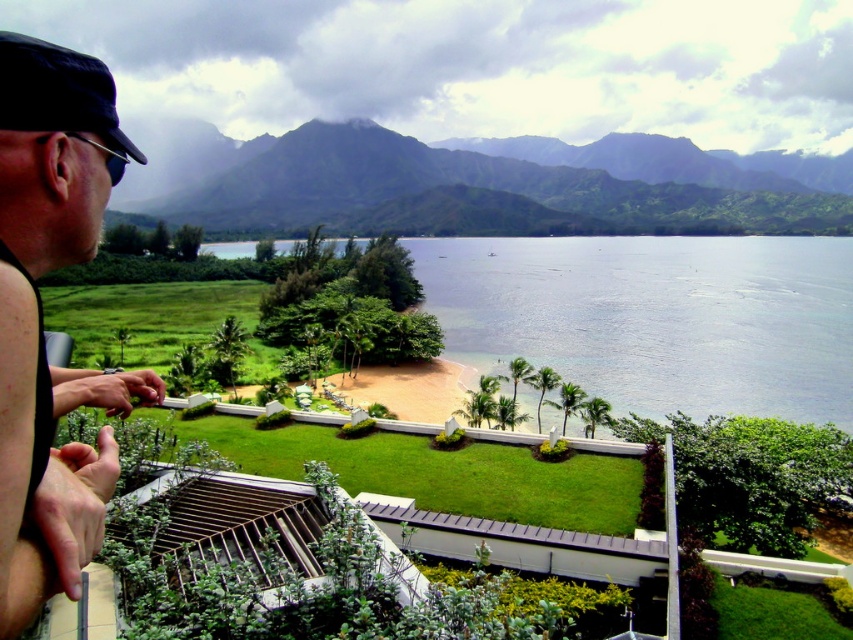
Question: Is sunglasses at left closer to the viewer compared to green grass at lower center?

Choices:
 (A) yes
 (B) no

Answer: (A)

Question: Which of the following is the closest to the observer?

Choices:
 (A) dark blue fabric baseball cap at left
 (B) green grass at lower center
 (C) green textured mountains at upper center
 (D) sunglasses at left

Answer: (D)

Question: Which of the following is the closest to the observer?

Choices:
 (A) (6, 104)
 (B) (548, 570)
 (C) (78, 65)

Answer: (A)

Question: Does green textured mountains at upper center appear on the left side of dark blue fabric baseball cap at left?

Choices:
 (A) yes
 (B) no

Answer: (B)

Question: Can you confirm if sunglasses at left is positioned above dark blue fabric baseball cap at left?

Choices:
 (A) no
 (B) yes

Answer: (A)

Question: Among these objects, which one is nearest to the camera?

Choices:
 (A) green grass at lower center
 (B) dark blue fabric baseball cap at left
 (C) green textured mountains at upper center
 (D) sunglasses at left

Answer: (D)